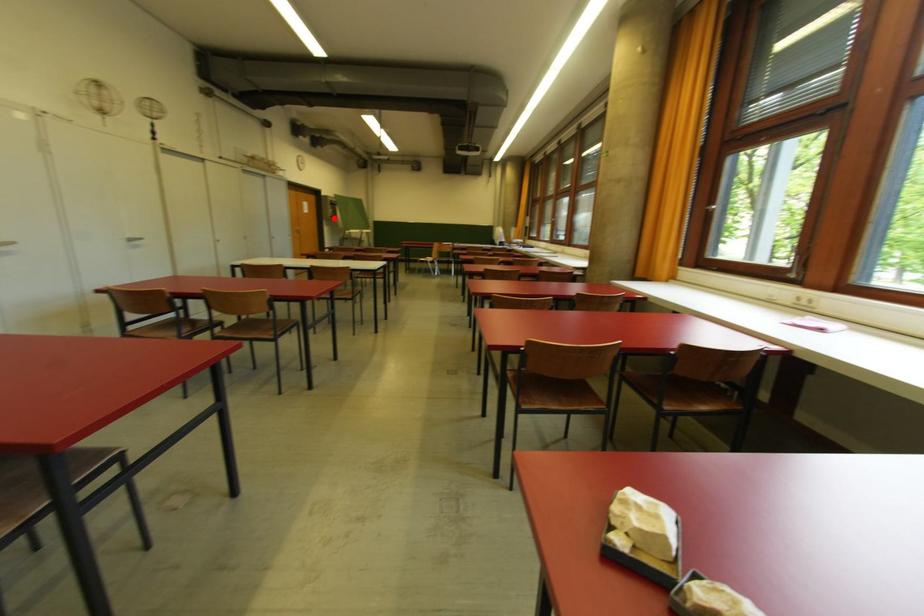
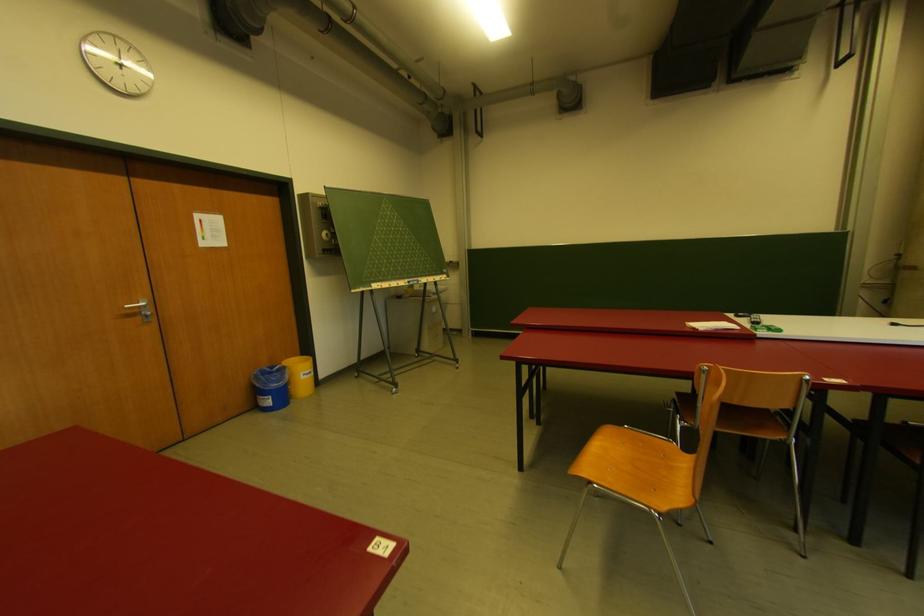
Question: I am providing you with two images of the same scene from different viewpoints. Given a red point in image1, look at the same physical point in image2. Is it:

Choices:
 (A) Closer to the viewpoint
 (B) Farther from the viewpoint

Answer: (B)